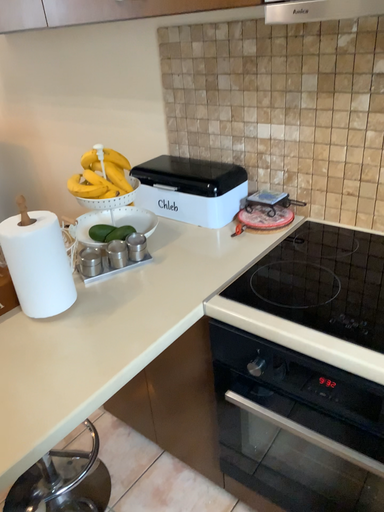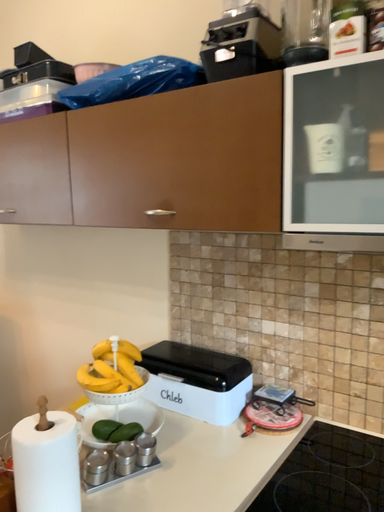
Question: Which way did the camera rotate in the video?

Choices:
 (A) rotated upward
 (B) rotated downward

Answer: (A)